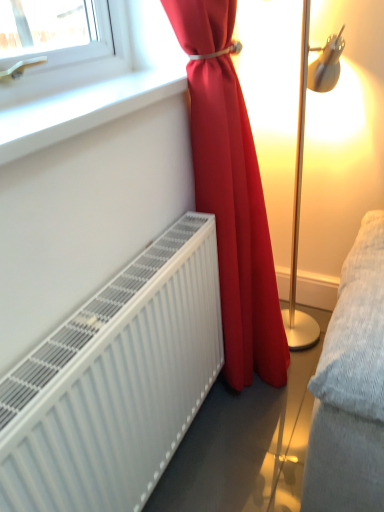
Question: From a real-world perspective, does matte red curtain at center sit lower than white matte radiator at lower left?

Choices:
 (A) no
 (B) yes

Answer: (A)

Question: Can you confirm if matte red curtain at center is bigger than white matte radiator at lower left?

Choices:
 (A) yes
 (B) no

Answer: (A)

Question: Is matte red curtain at center taller than white matte radiator at lower left?

Choices:
 (A) yes
 (B) no

Answer: (A)

Question: Is matte red curtain at center wider than white matte radiator at lower left?

Choices:
 (A) no
 (B) yes

Answer: (B)

Question: Does matte red curtain at center appear on the right side of white matte radiator at lower left?

Choices:
 (A) yes
 (B) no

Answer: (A)

Question: From a real-world perspective, is white matte radiator at lower left positioned above or below white smooth window sill at upper left?

Choices:
 (A) below
 (B) above

Answer: (A)

Question: Do you think white matte radiator at lower left is within white smooth window sill at upper left, or outside of it?

Choices:
 (A) outside
 (B) inside

Answer: (A)

Question: From the image's perspective, relative to white smooth window sill at upper left, is white matte radiator at lower left above or below?

Choices:
 (A) above
 (B) below

Answer: (B)

Question: Considering the relative positions of white matte radiator at lower left and white smooth window sill at upper left in the image provided, is white matte radiator at lower left to the left or to the right of white smooth window sill at upper left?

Choices:
 (A) right
 (B) left

Answer: (A)

Question: Considering the positions of matte red curtain at center and white matte radiator at lower left in the image, is matte red curtain at center taller or shorter than white matte radiator at lower left?

Choices:
 (A) short
 (B) tall

Answer: (B)

Question: Which is correct: matte red curtain at center is inside white matte radiator at lower left, or outside of it?

Choices:
 (A) outside
 (B) inside

Answer: (A)

Question: From the image's perspective, relative to white matte radiator at lower left, is matte red curtain at center above or below?

Choices:
 (A) above
 (B) below

Answer: (A)

Question: Is point (228, 297) closer or farther from the camera than point (41, 438)?

Choices:
 (A) farther
 (B) closer

Answer: (A)

Question: From the image's perspective, is white smooth window sill at upper left positioned above or below matte red curtain at center?

Choices:
 (A) below
 (B) above

Answer: (B)

Question: Relative to matte red curtain at center, is white smooth window sill at upper left in front or behind?

Choices:
 (A) front
 (B) behind

Answer: (A)